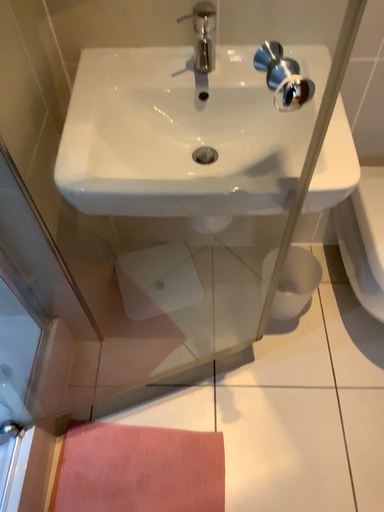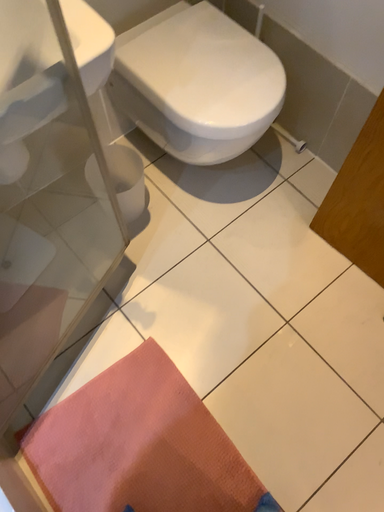
Question: Which way did the camera rotate in the video?

Choices:
 (A) rotated left
 (B) rotated right

Answer: (B)